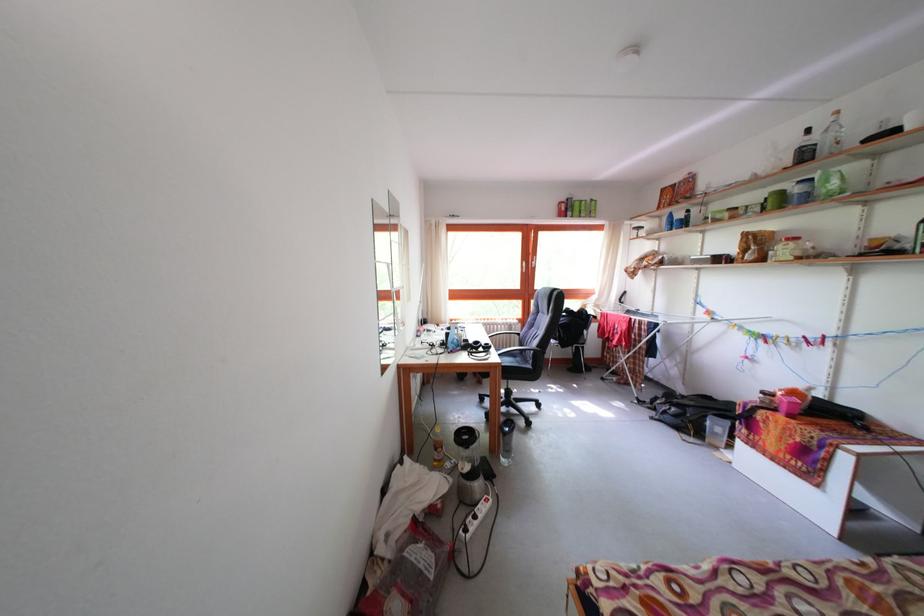
The image size is (924, 616). What do you see at coordinates (832, 136) in the screenshot? I see `a clear plastic bottle` at bounding box center [832, 136].